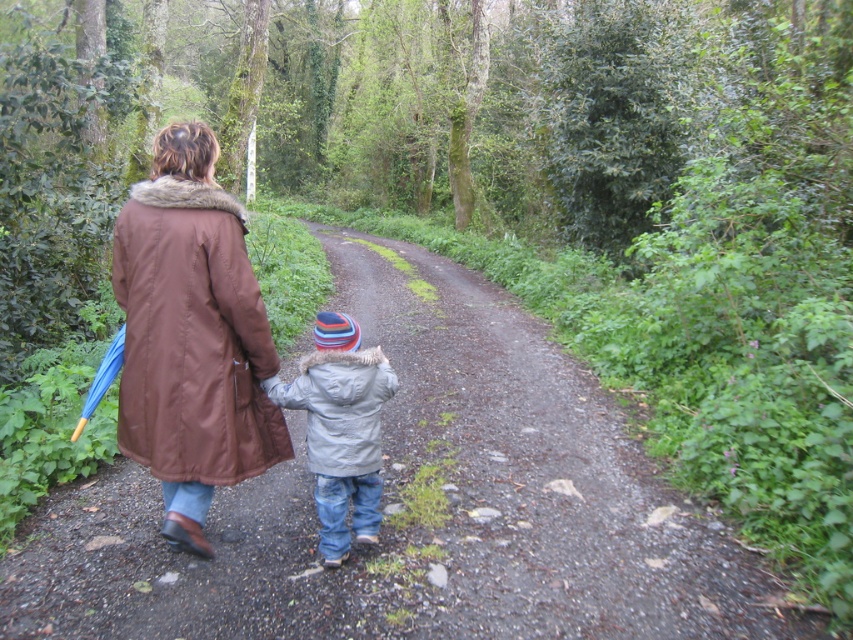
From the picture: Can you confirm if dirt road at center is shorter than brown synthetic coat at back?

No, dirt road at center is not shorter than brown synthetic coat at back.

Can you confirm if dirt road at center is wider than brown synthetic coat at back?

Indeed, dirt road at center has a greater width compared to brown synthetic coat at back.

Does point (323, 600) come behind point (148, 368)?

No.

Find the location of a particular element. dirt road at center is located at coordinates (537, 476).

Who is more forward, [625,492] or [305,362]?

Point [305,362] is more forward.

Does dirt road at center appear under gray matte jacket at center?

Correct, dirt road at center is located below gray matte jacket at center.

Between point (711, 548) and point (363, 432), which one is positioned behind?

The point (711, 548) is behind.

The image size is (853, 640). In order to click on dirt road at center in this screenshot , I will do `click(537, 476)`.

Between gray fleece jacket at center and gray matte jacket at center, which one appears on the right side from the viewer's perspective?

gray matte jacket at center is more to the right.

Who is shorter, gray fleece jacket at center or gray matte jacket at center?

gray matte jacket at center

What do you see at coordinates (340, 428) in the screenshot?
I see `gray fleece jacket at center` at bounding box center [340, 428].

This screenshot has height=640, width=853. In order to click on gray fleece jacket at center in this screenshot , I will do `click(340, 428)`.